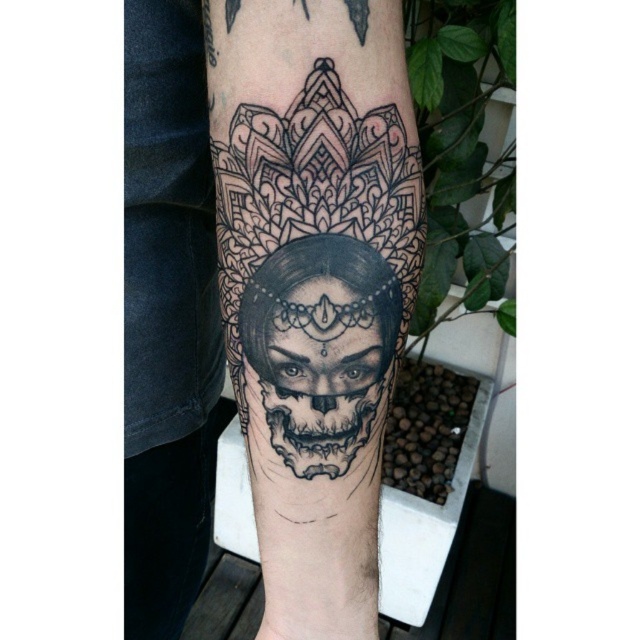
Is the position of black tattooed skull at center less distant than that of black detailed skull at center?

Yes, it is in front of black detailed skull at center.

At what (x,y) coordinates should I click in order to perform the action: click on black tattooed skull at center. Please return your answer as a coordinate pair (x, y). The width and height of the screenshot is (640, 640). Looking at the image, I should click on (264, 292).